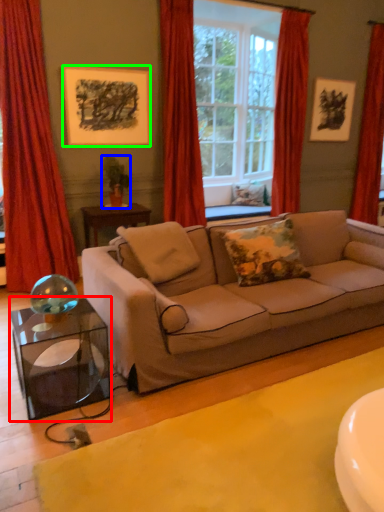
Question: Estimate the real-world distances between objects in this image. Which object is farther from table (highlighted by a red box), houseplant (highlighted by a blue box) or picture frame (highlighted by a green box)?

Choices:
 (A) houseplant
 (B) picture frame

Answer: (B)